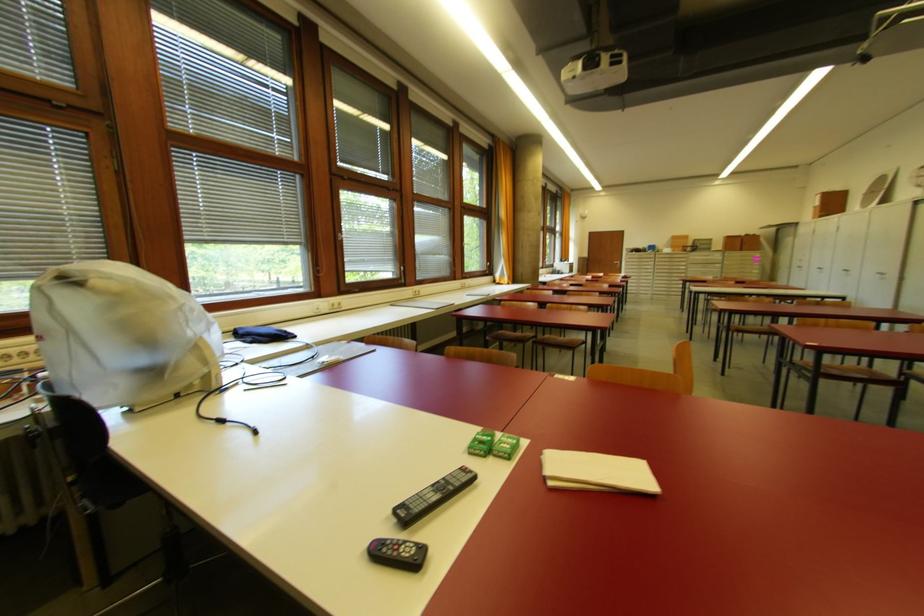
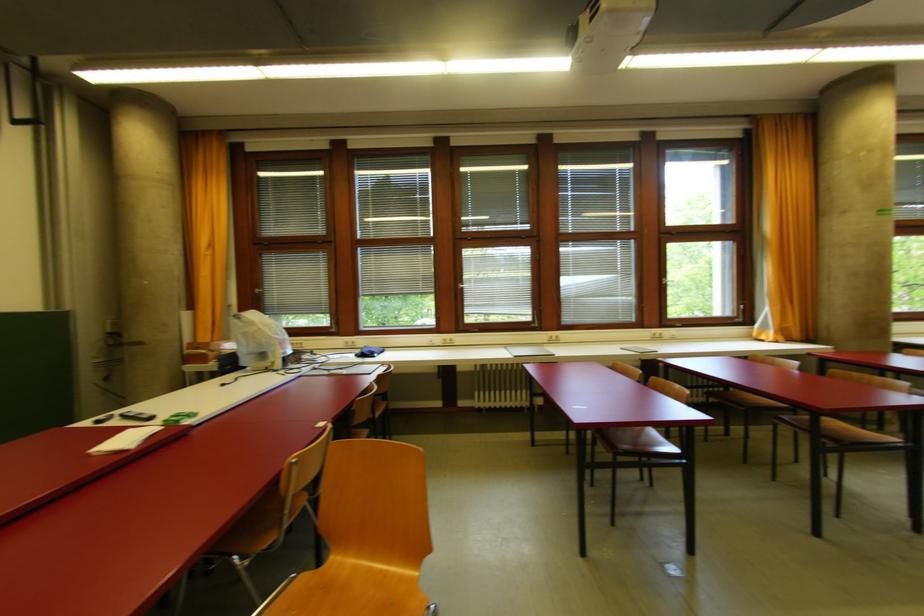
Find the pixel in the second image that matches (342,306) in the first image.

(454, 342)